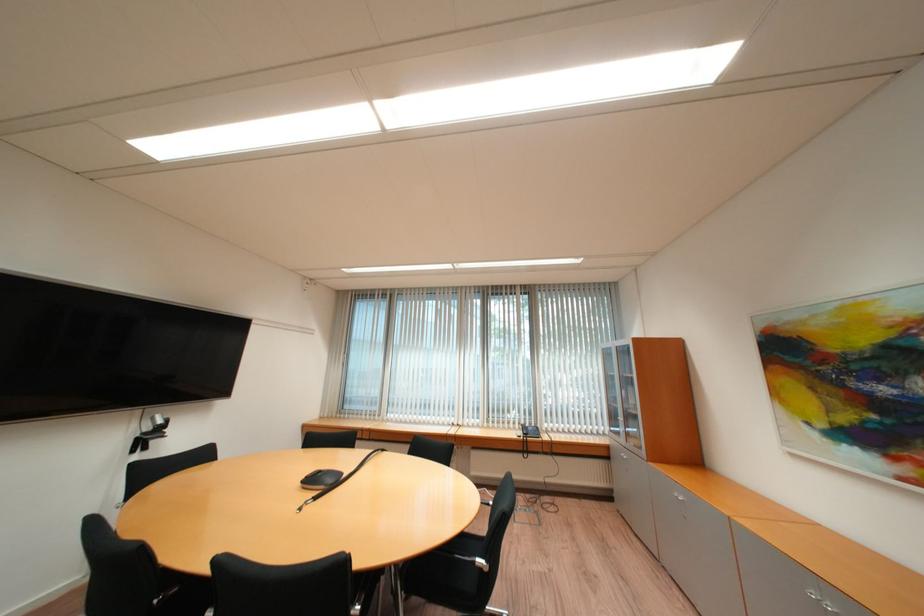
The height and width of the screenshot is (616, 924). Identify the location of white blind cord. (630, 436).